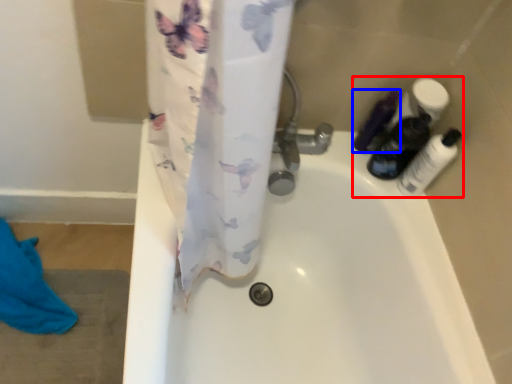
Question: Among these objects, which one is farthest to the camera, toiletry (highlighted by a red box) or toiletry (highlighted by a blue box)?

Choices:
 (A) toiletry
 (B) toiletry

Answer: (B)